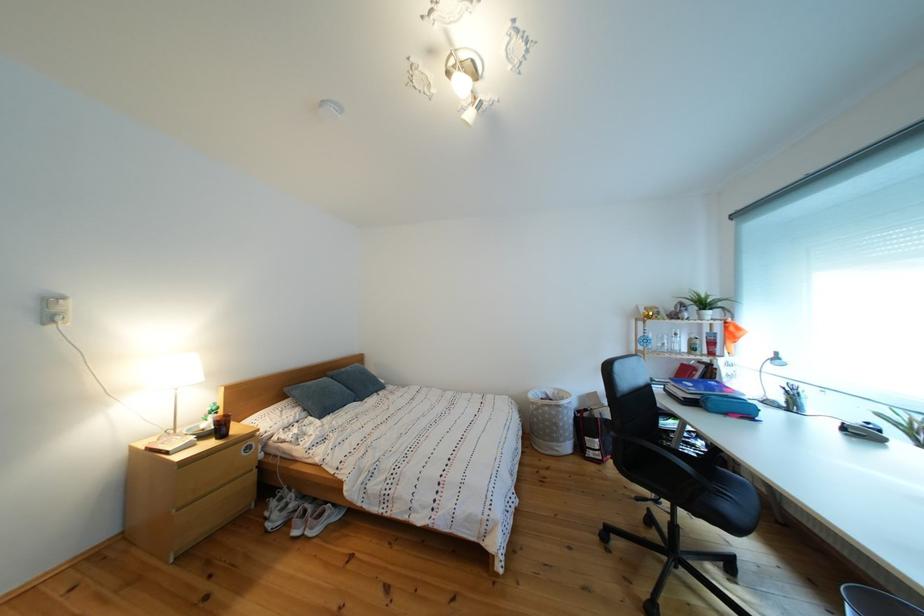
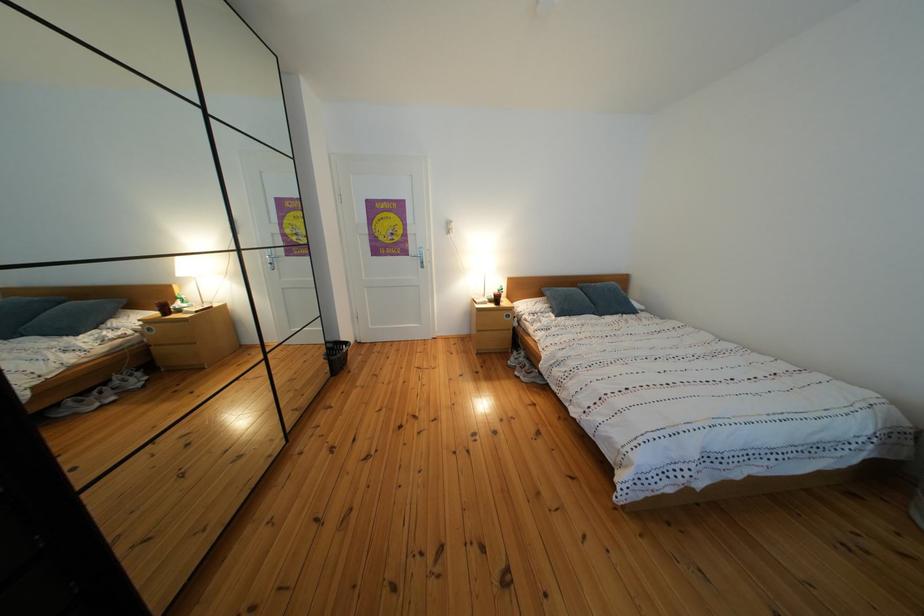
The first image is from the beginning of the video and the second image is from the end. How did the camera likely rotate when shooting the video?

The camera rotated toward left-down.